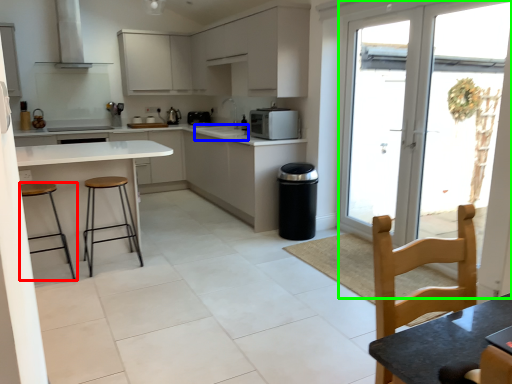
Question: Which object is the farthest from stool (highlighted by a red box)? Choose among these: sink (highlighted by a blue box) or glass door (highlighted by a green box).

Choices:
 (A) sink
 (B) glass door

Answer: (B)